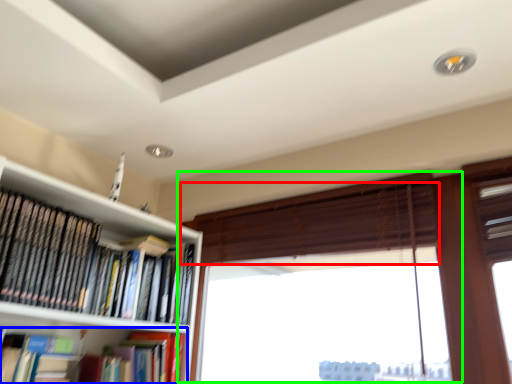
Question: Based on their relative distances, which object is farther from blind (highlighted by a red box)? Choose from book (highlighted by a blue box) and window (highlighted by a green box).

Choices:
 (A) book
 (B) window

Answer: (A)